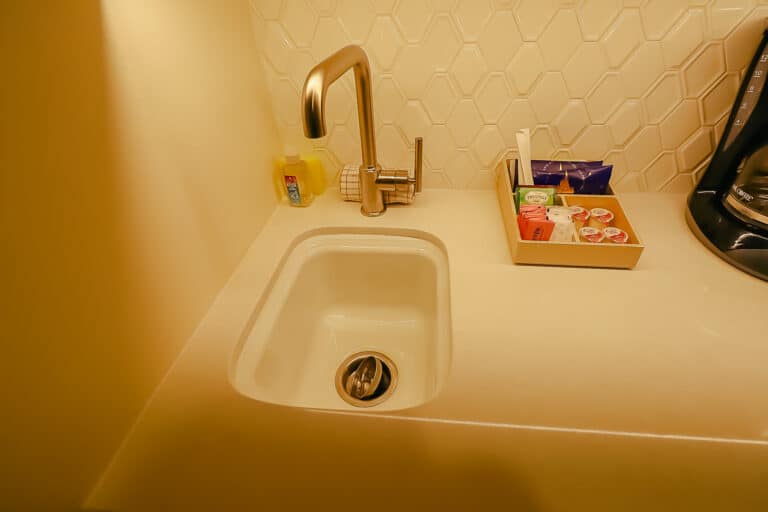
The height and width of the screenshot is (512, 768). Identify the location of walls. (192, 144), (508, 105).